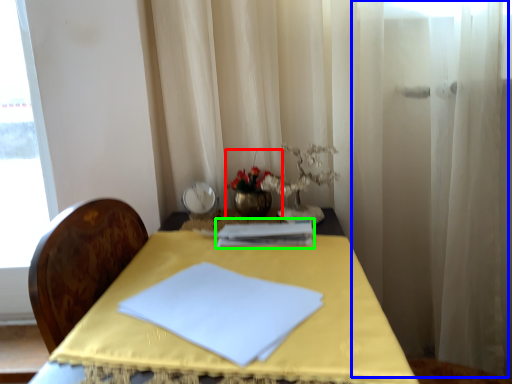
Question: Which object is the closest to the floral arrangement (highlighted by a red box)? Choose among these: curtain (highlighted by a blue box) or journal (highlighted by a green box).

Choices:
 (A) curtain
 (B) journal

Answer: (B)